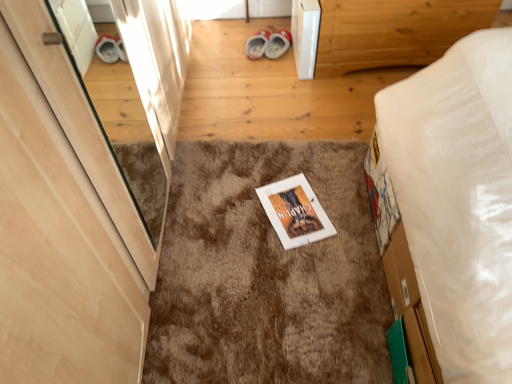
Where is `vacant space to the right of red suede shoes at center`? vacant space to the right of red suede shoes at center is located at coordinates (280, 41).